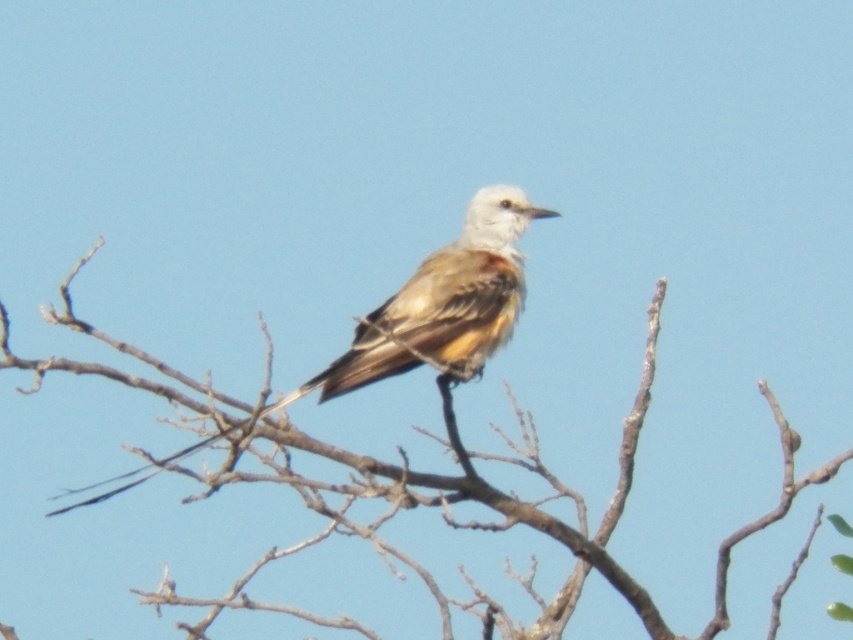
This screenshot has width=853, height=640. Describe the element at coordinates (407, 468) in the screenshot. I see `brown textured branch at center` at that location.

Does brown textured branch at center appear under brown feathered bird at center?

Indeed, brown textured branch at center is positioned under brown feathered bird at center.

Where is `brown textured branch at center`? brown textured branch at center is located at coordinates (407, 468).